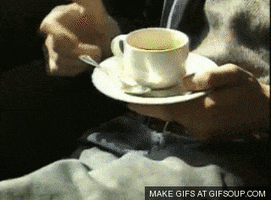
Locate an element on the screen. The height and width of the screenshot is (200, 271). white coffee cup is located at coordinates (153, 67).